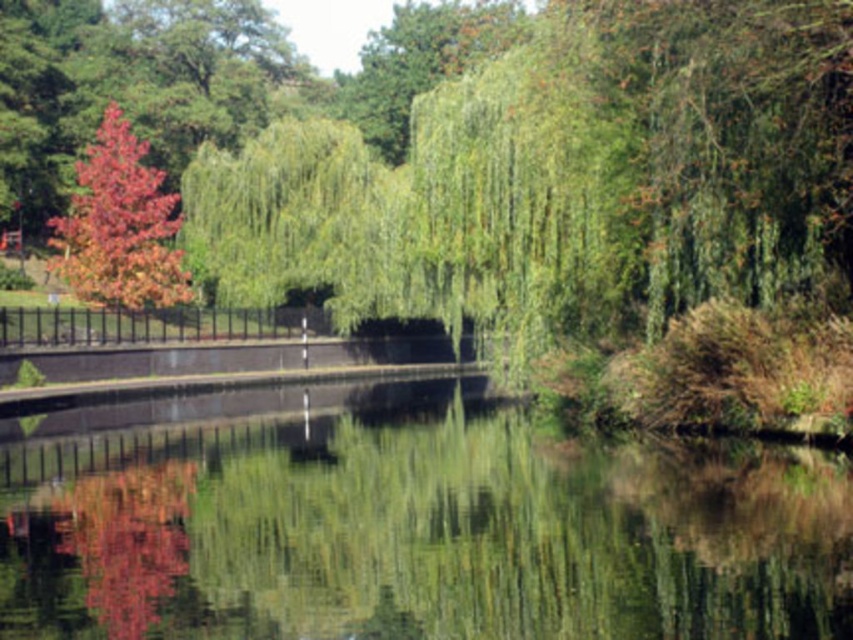
Question: Does green reflective water at center have a greater width compared to shiny red leaves at left?

Choices:
 (A) yes
 (B) no

Answer: (A)

Question: Which of the following is the closest to the observer?

Choices:
 (A) (134, 198)
 (B) (160, 608)

Answer: (B)

Question: Does green reflective water at center have a larger size compared to shiny red leaves at left?

Choices:
 (A) no
 (B) yes

Answer: (A)

Question: Which object is farther from the camera taking this photo?

Choices:
 (A) shiny red leaves at left
 (B) green reflective water at center

Answer: (A)

Question: Can you confirm if green reflective water at center is positioned below shiny red leaves at left?

Choices:
 (A) no
 (B) yes

Answer: (B)